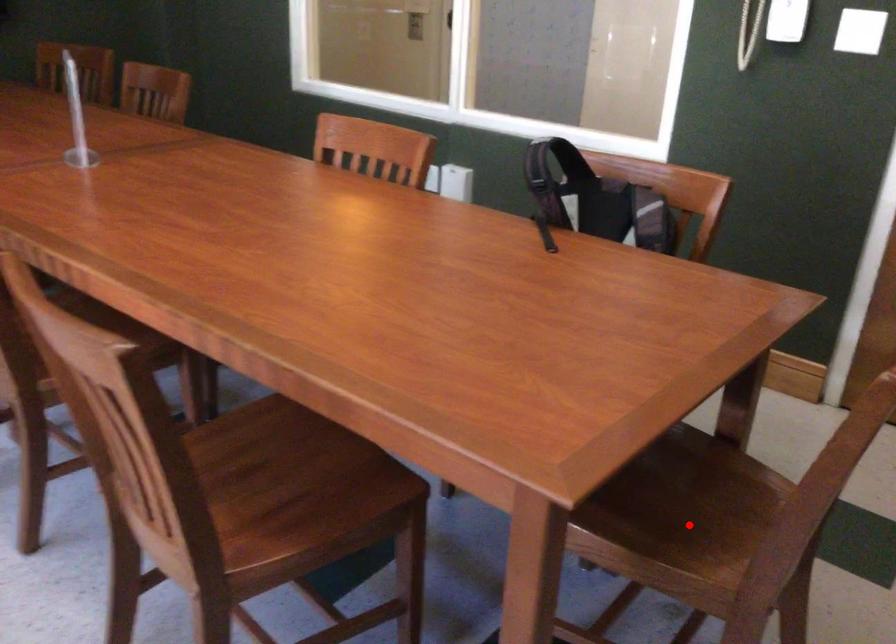
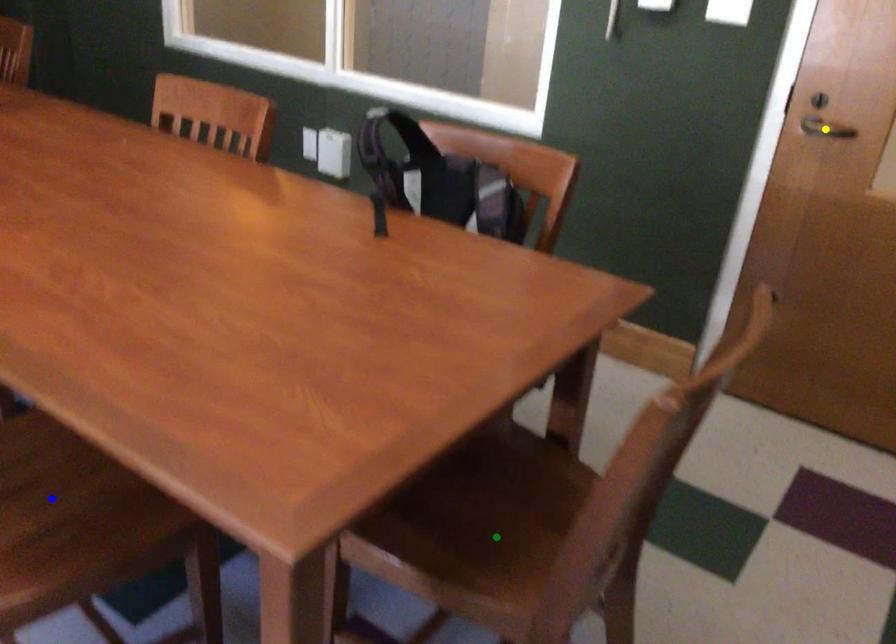
Question: I am providing you with two images of the same scene from different viewpoints. A red point is marked on the first image. You are given multiple points on the second image. In image 2, which mark is for the same physical point as the one in image 1?

Choices:
 (A) yellow point
 (B) blue point
 (C) green point

Answer: (C)